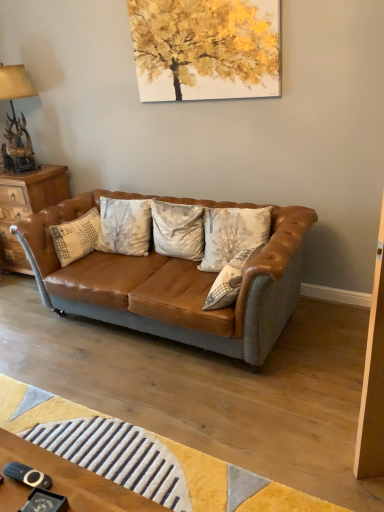
Question: From the image's perspective, is textured beige pillow at center, marked as the 4th pillow in a left-to-right arrangement, under textured beige pillow at center, which is counted as the third pillow, starting from the left?

Choices:
 (A) no
 (B) yes

Answer: (A)

Question: Can you confirm if textured beige pillow at center, marked as the 4th pillow in a left-to-right arrangement, is wider than textured beige pillow at center, the 2th pillow in the right-to-left sequence?

Choices:
 (A) yes
 (B) no

Answer: (A)

Question: From the image's perspective, does textured beige pillow at center, marked as the 4th pillow in a left-to-right arrangement, appear higher than textured beige pillow at center, which is counted as the third pillow, starting from the left?

Choices:
 (A) yes
 (B) no

Answer: (A)

Question: Does textured beige pillow at center, marked as the 4th pillow in a left-to-right arrangement, lie in front of textured beige pillow at center, the 2th pillow in the right-to-left sequence?

Choices:
 (A) yes
 (B) no

Answer: (B)

Question: Considering the relative positions of textured beige pillow at center, the first pillow positioned from the right, and textured beige pillow at center, which is counted as the third pillow, starting from the left, in the image provided, is textured beige pillow at center, the first pillow positioned from the right, to the left of textured beige pillow at center, which is counted as the third pillow, starting from the left, from the viewer's perspective?

Choices:
 (A) no
 (B) yes

Answer: (A)

Question: Considering the relative positions of textured beige pillow at center, the first pillow positioned from the right, and textured beige pillow at center, which is counted as the third pillow, starting from the left, in the image provided, is textured beige pillow at center, the first pillow positioned from the right, behind textured beige pillow at center, which is counted as the third pillow, starting from the left,?

Choices:
 (A) no
 (B) yes

Answer: (B)

Question: Could you tell me if silky beige pillow at center, the third pillow when ordered from right to left, is turned towards textured beige pillow at center, which is counted as the third pillow, starting from the left?

Choices:
 (A) yes
 (B) no

Answer: (B)

Question: From the image's perspective, is silky beige pillow at center, the third pillow when ordered from right to left, located above textured beige pillow at center, the 2th pillow in the right-to-left sequence?

Choices:
 (A) no
 (B) yes

Answer: (B)

Question: Considering the relative positions of silky beige pillow at center, the third pillow when ordered from right to left, and textured beige pillow at center, which is counted as the third pillow, starting from the left, in the image provided, is silky beige pillow at center, the third pillow when ordered from right to left, in front of textured beige pillow at center, which is counted as the third pillow, starting from the left,?

Choices:
 (A) yes
 (B) no

Answer: (B)

Question: Does silky beige pillow at center, the third pillow when ordered from right to left, have a smaller size compared to textured beige pillow at center, the 2th pillow in the right-to-left sequence?

Choices:
 (A) yes
 (B) no

Answer: (A)

Question: Is silky beige pillow at center, the third pillow when ordered from right to left, outside of textured beige pillow at center, the 2th pillow in the right-to-left sequence?

Choices:
 (A) yes
 (B) no

Answer: (A)

Question: Is silky beige pillow at center, the third pillow when ordered from right to left, turned away from textured beige pillow at center, the 2th pillow in the right-to-left sequence?

Choices:
 (A) yes
 (B) no

Answer: (B)

Question: Considering the relative positions of antler bronze lamp at upper left and leather couch at center in the image provided, is antler bronze lamp at upper left to the right of leather couch at center from the viewer's perspective?

Choices:
 (A) yes
 (B) no

Answer: (B)